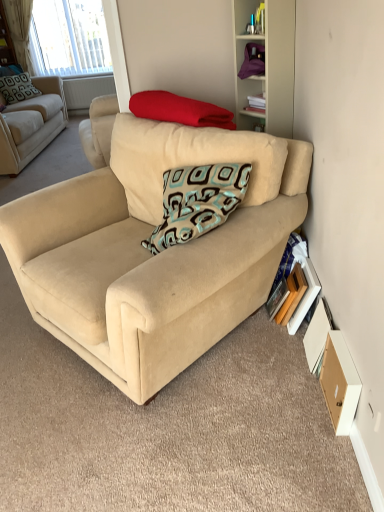
Question: Is hardcover book at lower right, the 1th paperback book when ordered from right to left, wider or thinner than white matte cabinet at upper right?

Choices:
 (A) wide
 (B) thin

Answer: (B)

Question: Is point (304, 296) positioned closer to the camera than point (248, 120)?

Choices:
 (A) closer
 (B) farther

Answer: (A)

Question: Considering the real-world distances, which object is farthest from the wooden paperback book at lower right, the 2th paperback book positioned from the right?

Choices:
 (A) teal-patterned fabric pillow at upper left, placed as the 2th pillow when sorted from bottom to top
 (B) wooden bookshelf at upper center, the first shelf in the left-to-right sequence
 (C) wooden drawer at lower right
 (D) hardcover book at lower right, the 1th paperback book when ordered from right to left
 (E) beige fabric couch at upper left, which ranks as the first studio couch in left-to-right order

Answer: (B)

Question: Based on their relative distances, which object is nearer to the wooden paperback book at lower right, the 2th paperback book positioned from the right?

Choices:
 (A) hardcover book at lower right, positioned as the 2th paperback book in left-to-right order
 (B) red soft blanket at upper center, which is counted as the 1th pillow, starting from the bottom
 (C) wooden bookshelf at upper center, the first shelf from the top
 (D) teal-patterned fabric pillow at upper left, the 1th pillow from the left
 (E) white matte cabinet at upper right

Answer: (A)